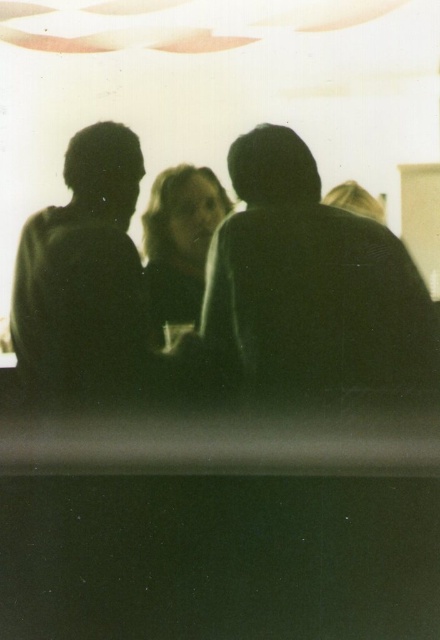
Question: Which point is farther from the camera taking this photo?

Choices:
 (A) (88, 378)
 (B) (146, 218)
 (C) (105, 326)

Answer: (C)

Question: Which of the following is the farthest from the observer?

Choices:
 (A) (363, 218)
 (B) (57, 232)
 (C) (157, 225)

Answer: (C)

Question: Does black matte head at left come behind smooth skin face at center?

Choices:
 (A) no
 (B) yes

Answer: (A)

Question: Which point is closer to the camera?

Choices:
 (A) smooth skin face at center
 (B) black matte head at left

Answer: (B)

Question: Does black matte people at center appear under black matte head at left?

Choices:
 (A) yes
 (B) no

Answer: (A)

Question: Does black matte people at center have a greater width compared to smooth skin face at center?

Choices:
 (A) yes
 (B) no

Answer: (A)